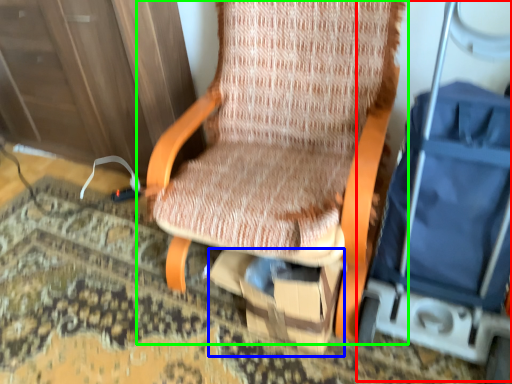
Question: Which is farther away from baby carriage (highlighted by a red box)? cardboard box (highlighted by a blue box) or chair (highlighted by a green box)?

Choices:
 (A) cardboard box
 (B) chair

Answer: (B)